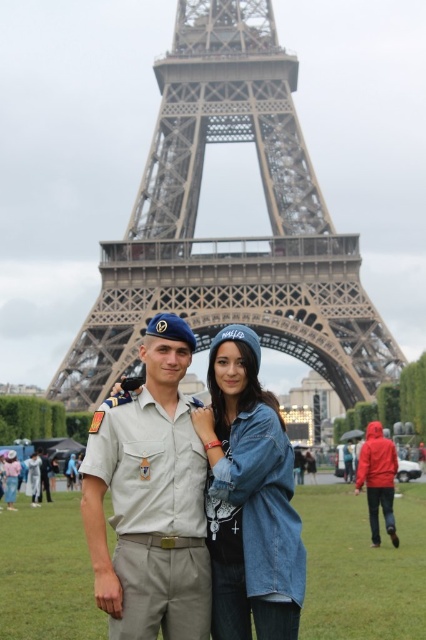
Question: Considering the relative positions of light beige uniform at center and denim jacket at center in the image provided, where is light beige uniform at center located with respect to denim jacket at center?

Choices:
 (A) above
 (B) below

Answer: (A)

Question: Which is nearer to the denim jacket at center?

Choices:
 (A) light beige uniform at center
 (B) matte red jacket at center

Answer: (A)

Question: Is metallic structure at center above matte red jacket at center?

Choices:
 (A) no
 (B) yes

Answer: (B)

Question: Which object is the farthest from the metallic structure at center?

Choices:
 (A) light beige uniform at center
 (B) denim jacket at center

Answer: (B)

Question: Is light beige uniform at center thinner than matte red jacket at center?

Choices:
 (A) no
 (B) yes

Answer: (A)

Question: Among these objects, which one is nearest to the camera?

Choices:
 (A) metallic structure at center
 (B) light beige uniform at center
 (C) denim jacket at center

Answer: (B)